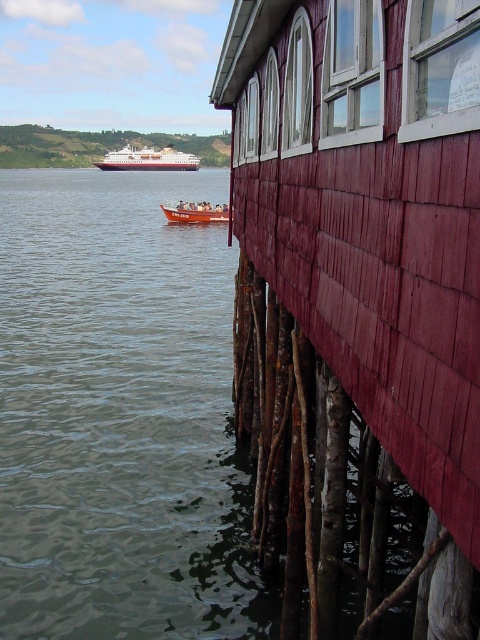
Question: Is white glossy cruise ship at upper left smaller than orange fiberglass boat at center?

Choices:
 (A) no
 (B) yes

Answer: (A)

Question: Which is nearer to the white glossy cruise ship at upper left?

Choices:
 (A) orange fiberglass boat at center
 (B) wooden shingles hut at right

Answer: (A)

Question: From the image, what is the correct spatial relationship of wooden shingles hut at right in relation to orange fiberglass boat at center?

Choices:
 (A) right
 (B) left

Answer: (A)

Question: Based on their relative distances, which object is nearer to the orange fiberglass boat at center?

Choices:
 (A) wooden shingles hut at right
 (B) white glossy cruise ship at upper left

Answer: (A)

Question: Which object appears farthest from the camera in this image?

Choices:
 (A) orange fiberglass boat at center
 (B) white glossy cruise ship at upper left
 (C) wooden shingles hut at right

Answer: (B)

Question: Is wooden shingles hut at right below orange fiberglass boat at center?

Choices:
 (A) yes
 (B) no

Answer: (A)